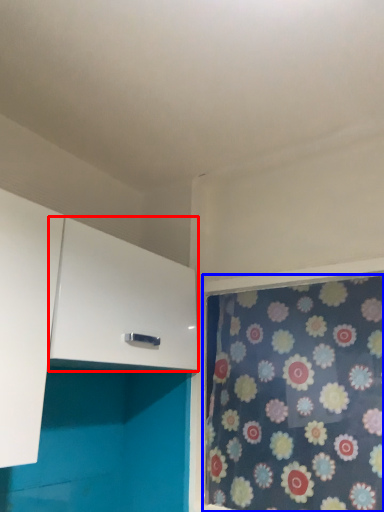
Question: Which point is closer to the camera, cabinetry (highlighted by a red box) or curtain (highlighted by a blue box)?

Choices:
 (A) cabinetry
 (B) curtain

Answer: (A)